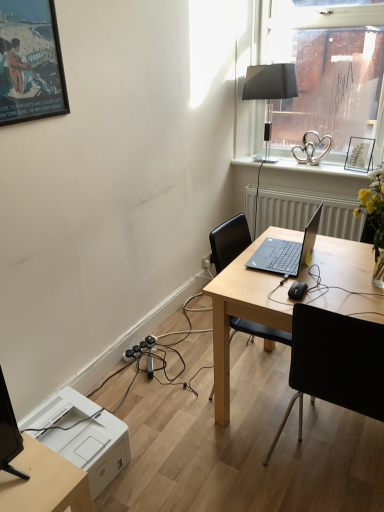
This screenshot has height=512, width=384. I want to click on vacant region to the left of light wood desk at center, so click(x=180, y=419).